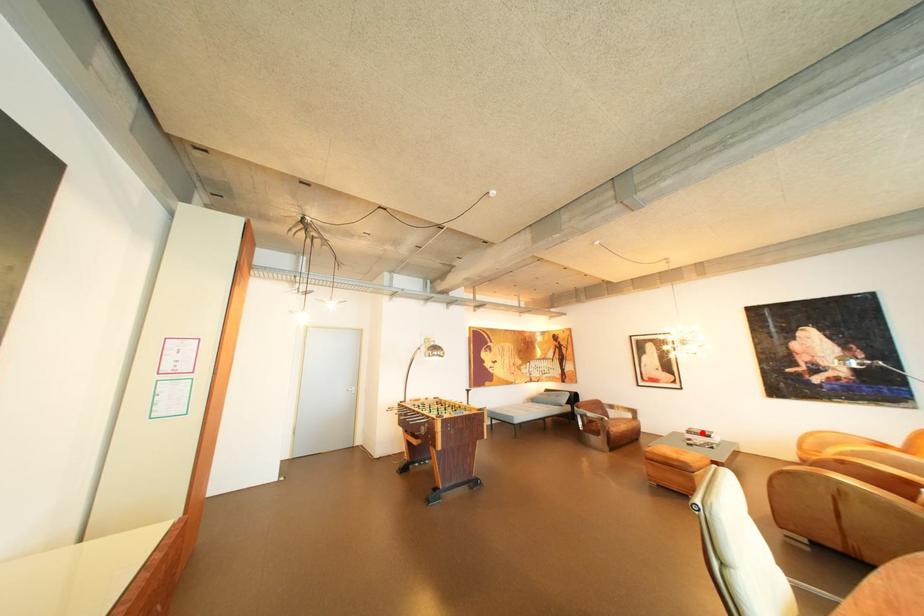
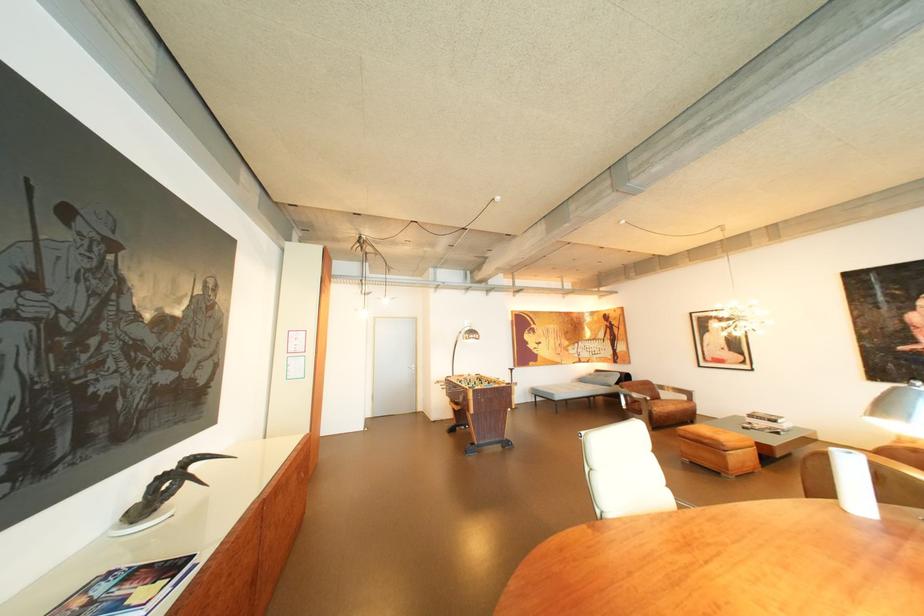
Find the pixel in the second image that matches the highlighted location in the first image.

(763, 416)